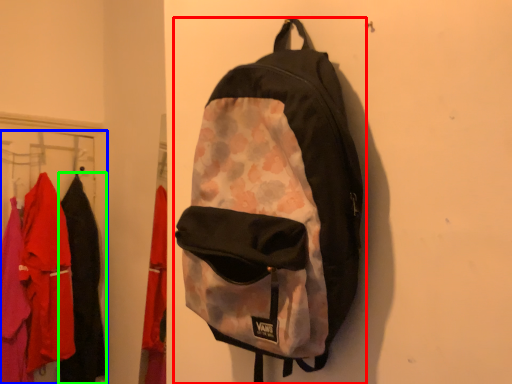
Question: Based on their relative distances, which object is nearer to backpack (highlighted by a red box)? Choose from closet (highlighted by a blue box) and clothing (highlighted by a green box).

Choices:
 (A) closet
 (B) clothing

Answer: (A)